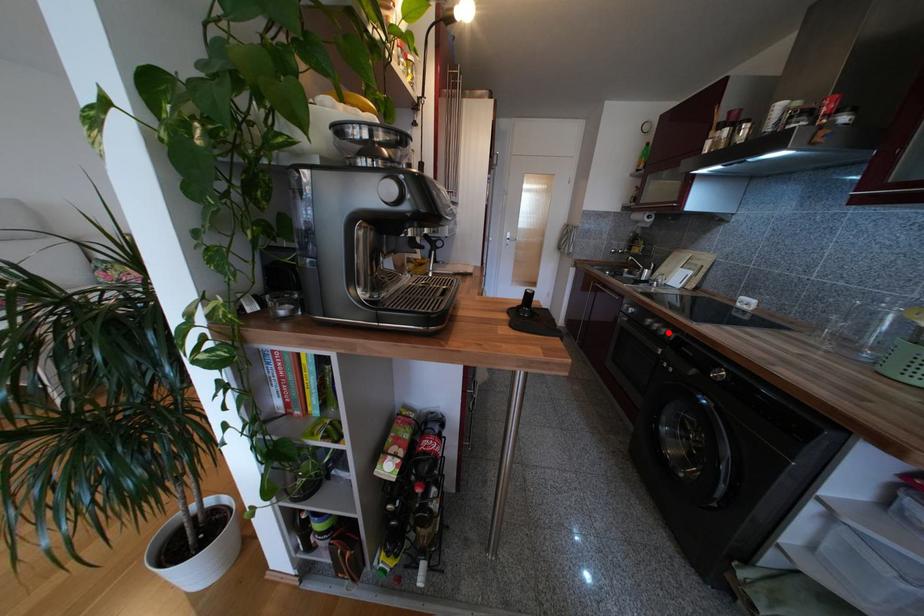
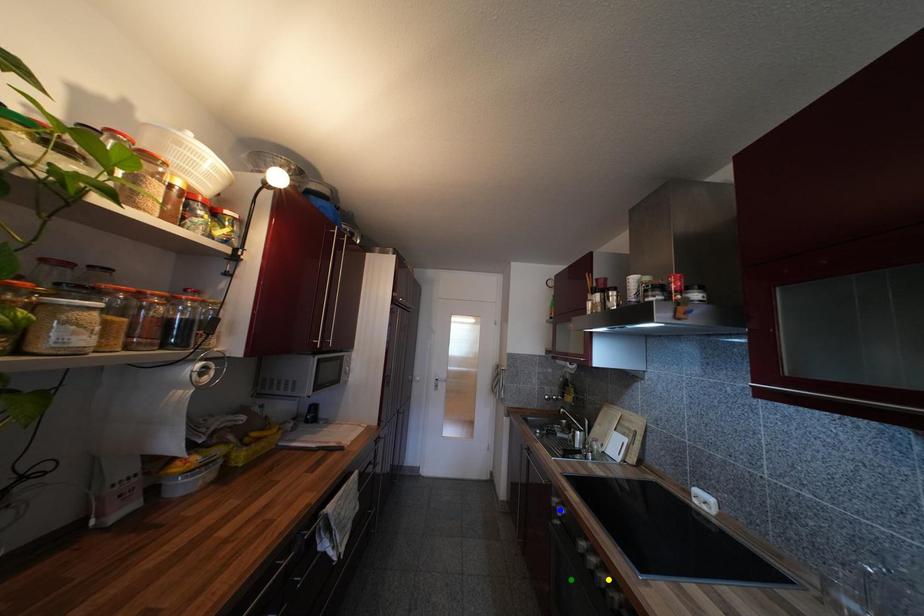
Question: I am providing you with two images of the same scene from different viewpoints. A red point is marked on the first image. You are given multiple points on the second image. Can you choose the point in image 2 that corresponds to the point in image 1?

Choices:
 (A) yellow point
 (B) green point
 (C) blue point

Answer: (A)